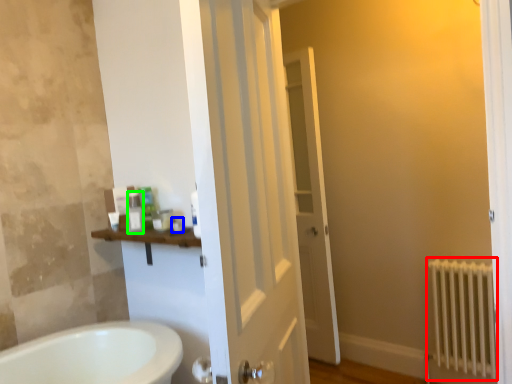
Question: Which object is the farthest from radiator (highlighted by a red box)? Choose among these: toiletry (highlighted by a blue box) or toiletry (highlighted by a green box).

Choices:
 (A) toiletry
 (B) toiletry

Answer: (B)